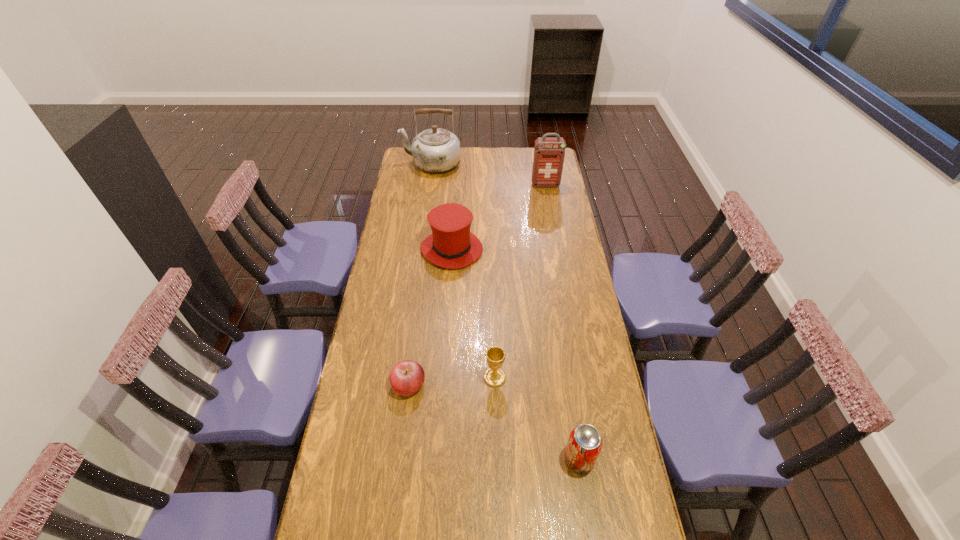
This screenshot has height=540, width=960. Identify the location of the farthest object. (436, 150).

Locate an element on the screen. The height and width of the screenshot is (540, 960). the second farthest object is located at coordinates (549, 153).

I want to click on hat, so click(x=451, y=245).

The image size is (960, 540). Find the location of `the fourth shortest object`. the fourth shortest object is located at coordinates (451, 245).

This screenshot has height=540, width=960. I want to click on soda can, so click(x=584, y=445).

Locate an element on the screen. This screenshot has width=960, height=540. chalice is located at coordinates (494, 376).

Identify the location of the shortest object. (407, 377).

The image size is (960, 540). I want to click on vacant region located on the front-facing side of the first-aid kit, so click(548, 199).

Identify the location of free spot located on the back of the third tallest object. (454, 219).

The image size is (960, 540). What are the coordinates of `vacant point located on the back of the nearest object` in the screenshot? It's located at (569, 395).